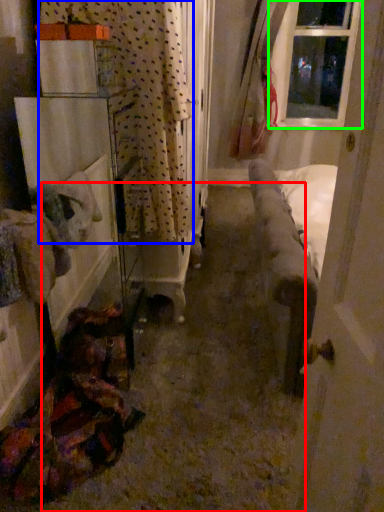
Question: Considering the real-world distances, which object is closest to path (highlighted by a red box)? curtain (highlighted by a blue box) or window (highlighted by a green box).

Choices:
 (A) curtain
 (B) window

Answer: (A)